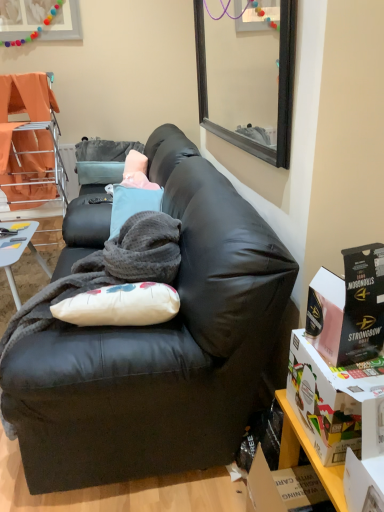
Question: Is matte cardboard box at lower right, arranged as the first box when ordered from the bottom, at the left side of matte black box at right, marked as the 1th box in a top-to-bottom arrangement?

Choices:
 (A) no
 (B) yes

Answer: (A)

Question: From the image's perspective, is matte cardboard box at lower right, arranged as the first box when ordered from the bottom, on top of matte black box at right, marked as the 1th box in a top-to-bottom arrangement?

Choices:
 (A) no
 (B) yes

Answer: (A)

Question: Is matte cardboard box at lower right, arranged as the first box when ordered from the bottom, outside of matte black box at right, which is the second box from bottom to top?

Choices:
 (A) no
 (B) yes

Answer: (B)

Question: Is matte cardboard box at lower right, arranged as the first box when ordered from the bottom, further to the viewer compared to matte black box at right, marked as the 1th box in a top-to-bottom arrangement?

Choices:
 (A) no
 (B) yes

Answer: (A)

Question: Is matte cardboard box at lower right, arranged as the first box when ordered from the bottom, positioned with its back to matte black box at right, which is the second box from bottom to top?

Choices:
 (A) yes
 (B) no

Answer: (B)

Question: Can you confirm if matte cardboard box at lower right, positioned as the 2th box in top-to-bottom order, is smaller than matte black box at right, which is the second box from bottom to top?

Choices:
 (A) yes
 (B) no

Answer: (B)

Question: Is orange fabric chair at left taller than matte cardboard box at lower right, positioned as the 2th box in top-to-bottom order?

Choices:
 (A) no
 (B) yes

Answer: (B)

Question: Can you confirm if orange fabric chair at left is wider than matte cardboard box at lower right, arranged as the first box when ordered from the bottom?

Choices:
 (A) no
 (B) yes

Answer: (B)

Question: Are orange fabric chair at left and matte cardboard box at lower right, arranged as the first box when ordered from the bottom, located far from each other?

Choices:
 (A) no
 (B) yes

Answer: (B)

Question: From a real-world perspective, is orange fabric chair at left beneath matte cardboard box at lower right, arranged as the first box when ordered from the bottom?

Choices:
 (A) no
 (B) yes

Answer: (A)

Question: Is orange fabric chair at left in front of matte cardboard box at lower right, arranged as the first box when ordered from the bottom?

Choices:
 (A) no
 (B) yes

Answer: (A)

Question: Considering the relative sizes of orange fabric chair at left and matte cardboard box at lower right, arranged as the first box when ordered from the bottom, in the image provided, is orange fabric chair at left bigger than matte cardboard box at lower right, arranged as the first box when ordered from the bottom,?

Choices:
 (A) yes
 (B) no

Answer: (A)

Question: Considering the relative positions of wooden shelf at lower right and orange fabric chair at left in the image provided, is wooden shelf at lower right to the left of orange fabric chair at left from the viewer's perspective?

Choices:
 (A) no
 (B) yes

Answer: (A)